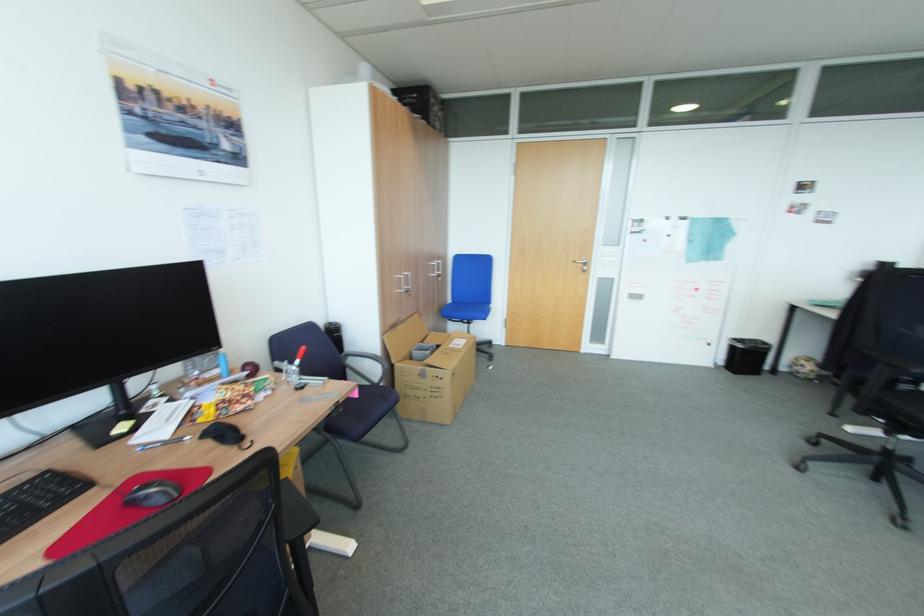
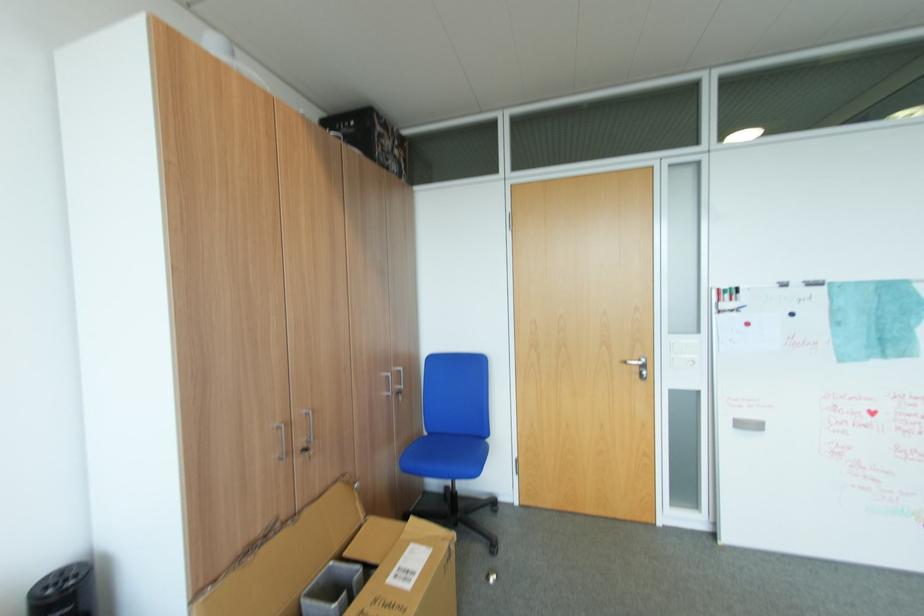
Locate, in the second image, the point that corresponds to pixel 411 292 in the first image.

(310, 451)